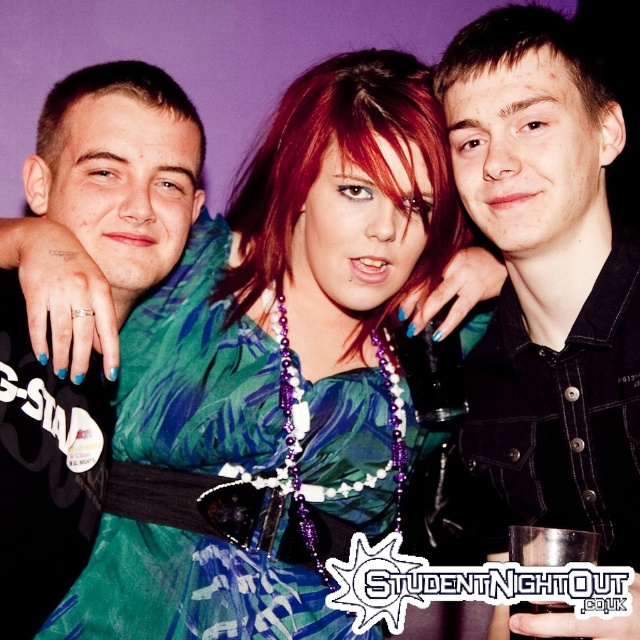
Between green satin dress at center and matte black shirt at center, which one appears on the right side from the viewer's perspective?

green satin dress at center is more to the right.

What do you see at coordinates (196, 371) in the screenshot?
I see `green satin dress at center` at bounding box center [196, 371].

This screenshot has height=640, width=640. Describe the element at coordinates (196, 371) in the screenshot. I see `green satin dress at center` at that location.

Identify the location of green satin dress at center. This screenshot has width=640, height=640. (196, 371).

Is black denim jacket at upper center further to the viewer compared to green satin dress at center?

No, it is in front of green satin dress at center.

Who is more distant from viewer, (580, 248) or (129, 419)?

Point (129, 419)

The height and width of the screenshot is (640, 640). Describe the element at coordinates (548, 292) in the screenshot. I see `black denim jacket at upper center` at that location.

Image resolution: width=640 pixels, height=640 pixels. In order to click on black denim jacket at upper center in this screenshot , I will do `click(548, 292)`.

Can you confirm if black denim jacket at upper center is bigger than matte black shirt at center?

Correct, black denim jacket at upper center is larger in size than matte black shirt at center.

What do you see at coordinates (548, 292) in the screenshot? This screenshot has height=640, width=640. I see `black denim jacket at upper center` at bounding box center [548, 292].

Locate an element on the screen. This screenshot has height=640, width=640. black denim jacket at upper center is located at coordinates (548, 292).